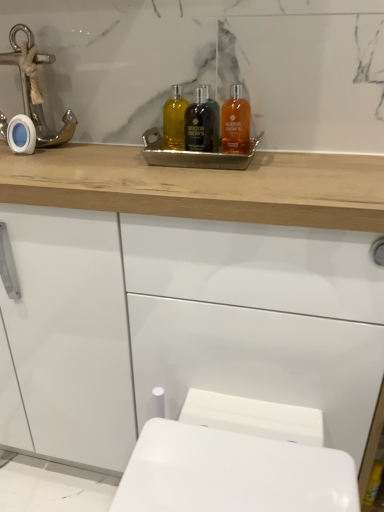
Question: Is white glossy porcelain at lower center in front of or behind metallic anchor at left in the image?

Choices:
 (A) behind
 (B) front

Answer: (B)

Question: From the image's perspective, relative to metallic anchor at left, is white glossy porcelain at lower center above or below?

Choices:
 (A) below
 (B) above

Answer: (A)

Question: Estimate the real-world distances between objects in this image. Which object is farther from the translucent amber liquid at center, the 1th mouthwash positioned from the left?

Choices:
 (A) translucent amber liquid at upper center, the 1th mouthwash when ordered from right to left
 (B) white glossy cabinet at upper center
 (C) black glass bottle at center, the 2th mouthwash from the right
 (D) metallic anchor at left
 (E) metallic tray at center

Answer: (D)

Question: Considering the real-world distances, which object is closest to the metallic anchor at left?

Choices:
 (A) translucent amber liquid at upper center, the 1th mouthwash when ordered from right to left
 (B) white glossy cabinet at upper center
 (C) black glass bottle at center, arranged as the 2th mouthwash when viewed from the left
 (D) white glossy porcelain at lower center
 (E) metallic tray at center

Answer: (E)